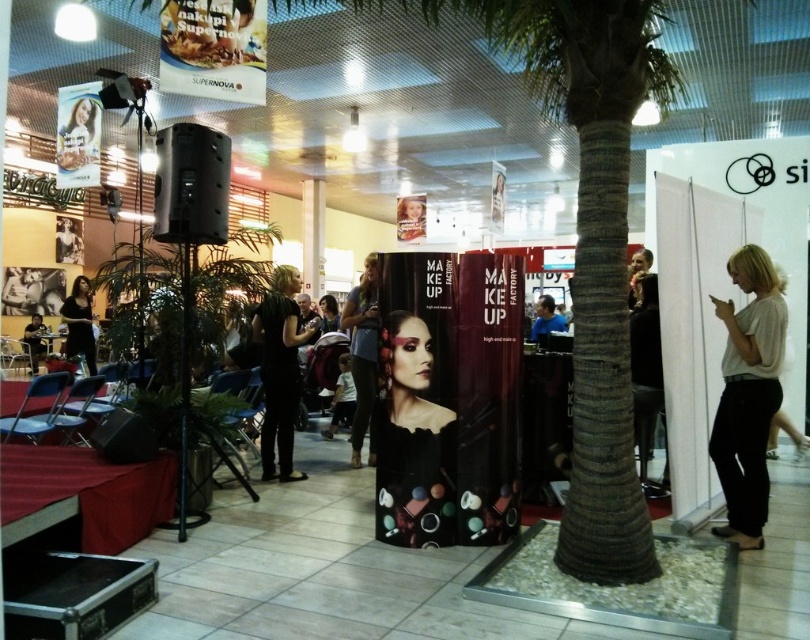
Question: Among these objects, which one is farthest from the camera?

Choices:
 (A) black matte dress at left
 (B) black matte dress at center

Answer: (A)

Question: Does matte black makeup at center appear on the left side of black matte dress at center?

Choices:
 (A) no
 (B) yes

Answer: (A)

Question: Can you confirm if matte black makeup at center is wider than matte black dress at center?

Choices:
 (A) yes
 (B) no

Answer: (A)

Question: Which point is closer to the camera?

Choices:
 (A) matte black dress at center
 (B) black matte dress at left
 (C) matte black makeup at center
 (D) white matte shirt at right

Answer: (D)

Question: Is the position of matte black makeup at center less distant than that of black matte dress at center?

Choices:
 (A) no
 (B) yes

Answer: (B)

Question: Which of the following is the farthest from the observer?

Choices:
 (A) black matte dress at center
 (B) white matte shirt at right
 (C) black matte dress at left

Answer: (C)